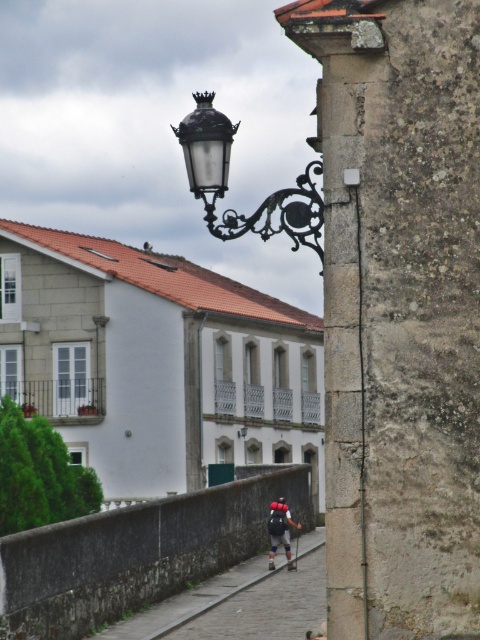
Is point (300, 403) closer to camera compared to point (277, 509)?

No, it is behind (277, 509).

Which is more to the left, white stone building at upper left or matte black backpack at center?

white stone building at upper left

The image size is (480, 640). I want to click on white stone building at upper left, so (156, 362).

Locate an element on the screen. This screenshot has width=480, height=640. white stone building at upper left is located at coordinates (156, 362).

Does white stone building at upper left appear under black wrought iron streetlight at upper center?

Yes, white stone building at upper left is below black wrought iron streetlight at upper center.

Who is more forward, (297, 342) or (245, 228)?

Point (245, 228)

You are a GUI agent. You are given a task and a screenshot of the screen. Output one action in this format:
    pyautogui.click(x=<x>, y=<y>)
    Task: Click on the white stone building at upper left
    
    Given the screenshot: What is the action you would take?
    pyautogui.click(x=156, y=362)

Which is behind, point (213, 230) or point (279, 512)?

The point (279, 512) is more distant.

The width and height of the screenshot is (480, 640). I want to click on black wrought iron streetlight at upper center, so click(227, 182).